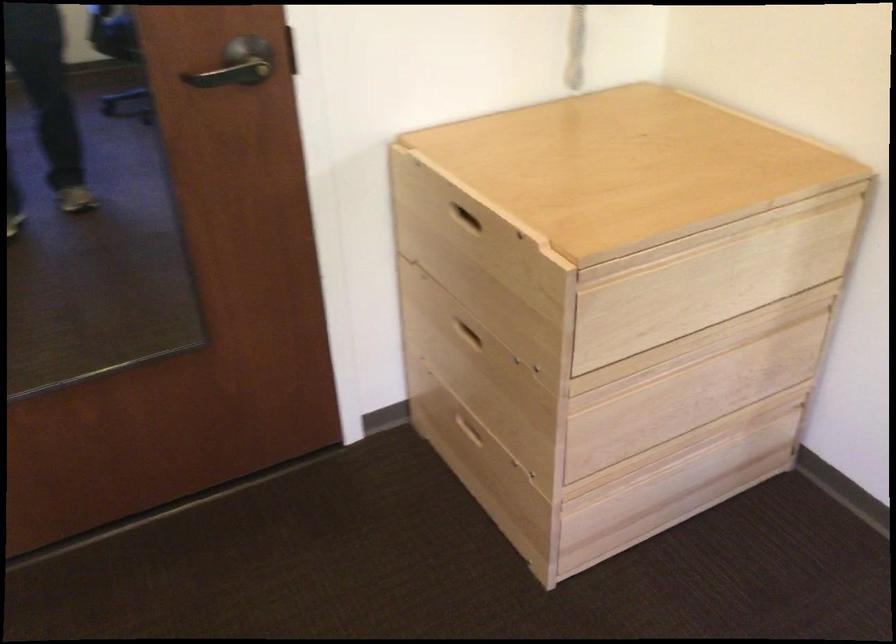
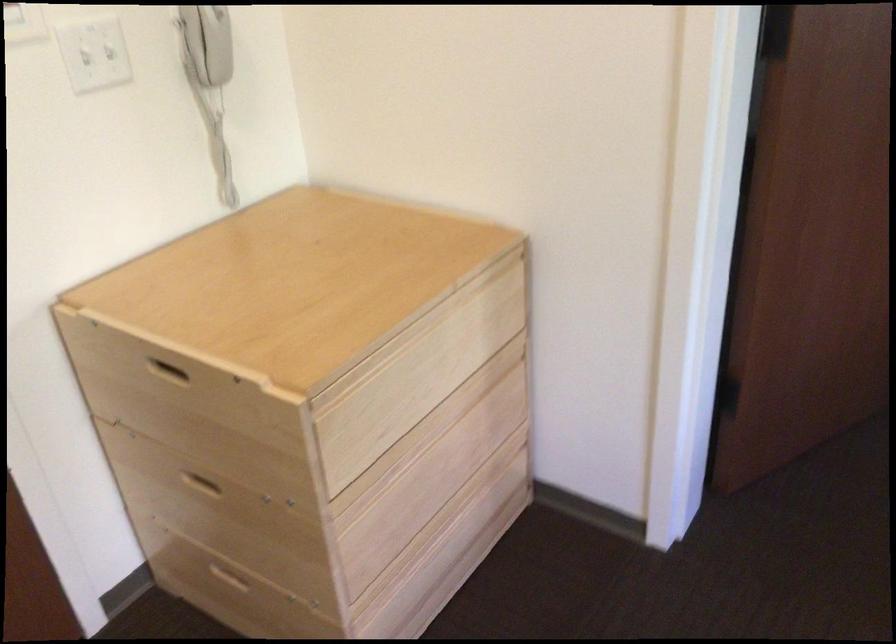
Question: Based on the continuous images, in which direction is the camera rotating? Reply with the corresponding letter.

Choices:
 (A) Left
 (B) Right
 (C) Up
 (D) Down

Answer: (B)